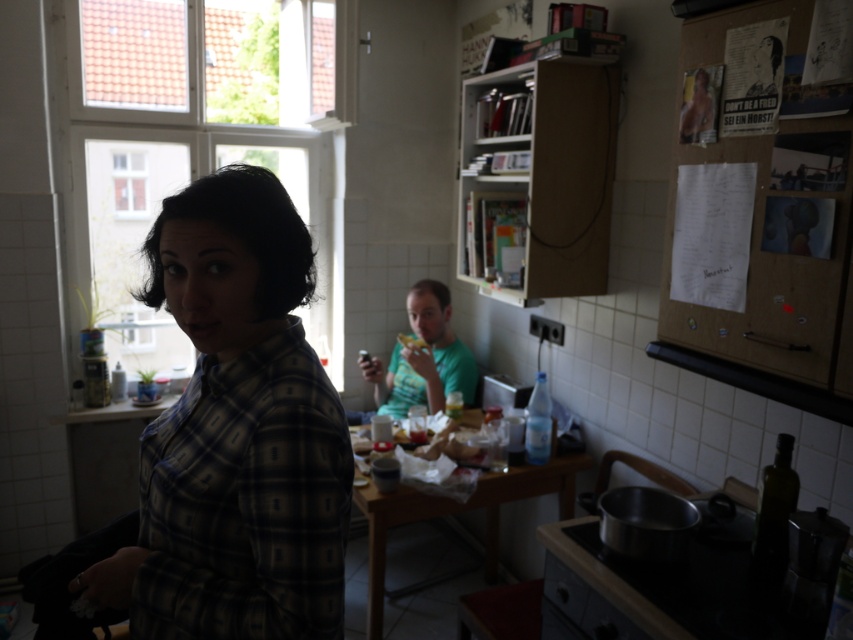
Question: Is plaid shirt at center above green matte shirt at center?

Choices:
 (A) no
 (B) yes

Answer: (B)

Question: Is green matte shirt at center thinner than yellow matte sandwich at center?

Choices:
 (A) no
 (B) yes

Answer: (A)

Question: Which point is farther to the camera?

Choices:
 (A) (396, 337)
 (B) (444, 362)

Answer: (A)

Question: Does plaid shirt at center have a larger size compared to green matte shirt at center?

Choices:
 (A) yes
 (B) no

Answer: (B)

Question: Which point appears closest to the camera in this image?

Choices:
 (A) (415, 342)
 (B) (337, 600)

Answer: (B)

Question: Among these points, which one is nearest to the camera?

Choices:
 (A) (380, 410)
 (B) (410, 340)
 (C) (219, 506)

Answer: (C)